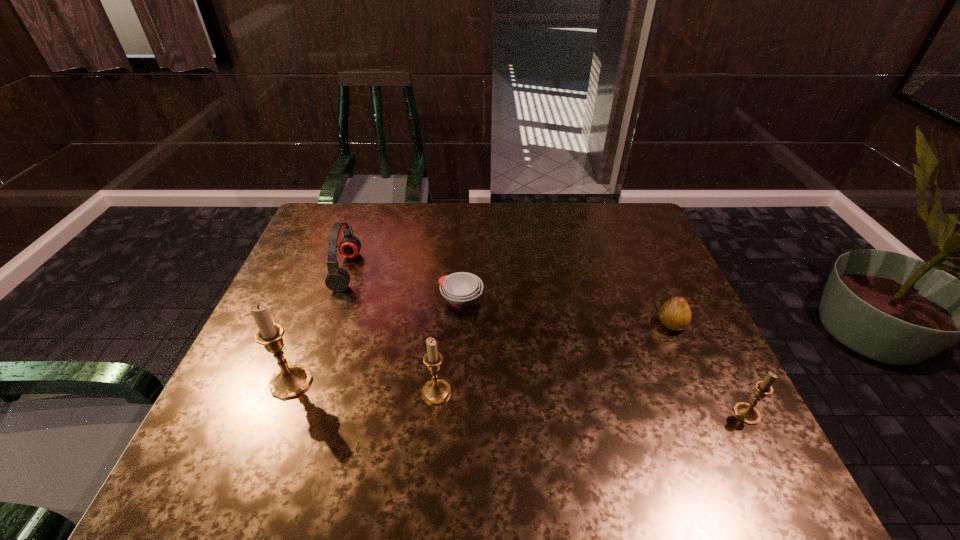
Identify the location of candle holder that stands as the second closest to the leftmost candle holder. (747, 413).

The height and width of the screenshot is (540, 960). I want to click on vacant space that satisfies the following two spatial constraints: 1. on the front side of the shortest candle holder; 2. on the right side of the pear, so click(711, 414).

I want to click on vacant space that satisfies the following two spatial constraints: 1. on the ear cups of the second candle holder from left to right; 2. on the left side of the earphone, so click(x=304, y=392).

Locate an element on the screen. Image resolution: width=960 pixels, height=540 pixels. vacant space that satisfies the following two spatial constraints: 1. on the ear cups of the earphone; 2. on the right side of the second tallest candle holder is located at coordinates (304, 392).

This screenshot has height=540, width=960. What are the coordinates of `vacant space that satisfies the following two spatial constraints: 1. on the ear cups of the earphone; 2. on the back side of the pear` in the screenshot? It's located at point(328,324).

Find the location of a particular element. blank space that satisfies the following two spatial constraints: 1. on the back side of the leftmost candle holder; 2. on the right side of the fifth object from left to right is located at coordinates (313, 324).

Locate an element on the screen. The image size is (960, 540). vacant area in the image that satisfies the following two spatial constraints: 1. on the front side of the shortest candle holder; 2. on the right side of the shortest object is located at coordinates (456, 414).